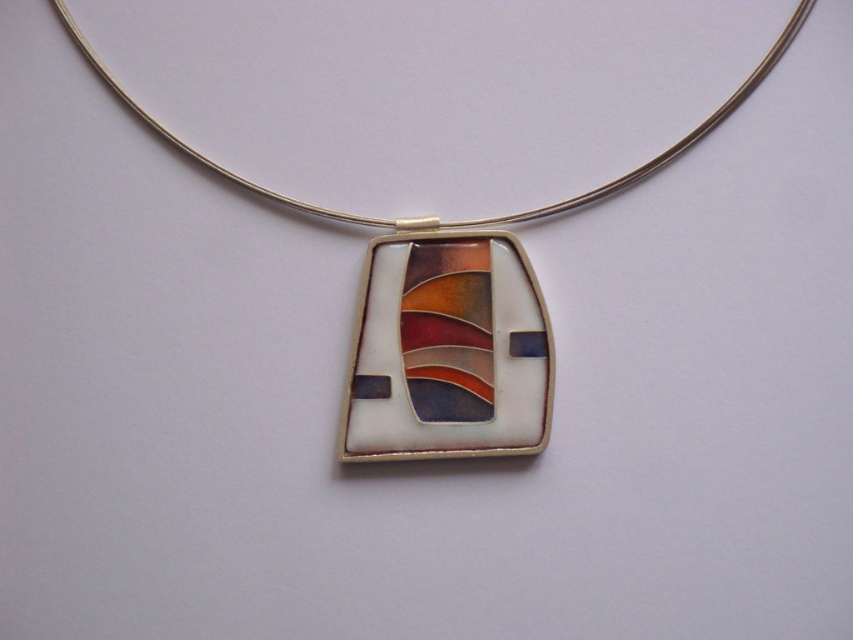
Is point (648, 166) less distant than point (413, 396)?

Yes, point (648, 166) is in front of point (413, 396).

Measure the distance between matte silver pendant at center and camera.

The distance of matte silver pendant at center from camera is 4.22 feet.

The height and width of the screenshot is (640, 853). What are the coordinates of `matte silver pendant at center` in the screenshot? It's located at [x=450, y=312].